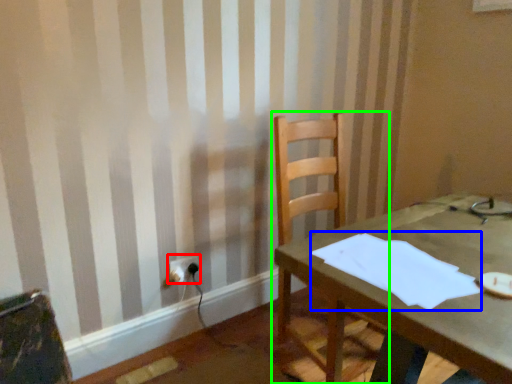
Question: Which is nearer to the electric outlet (highlighted by a red box)? paper (highlighted by a blue box) or chair (highlighted by a green box).

Choices:
 (A) paper
 (B) chair

Answer: (B)